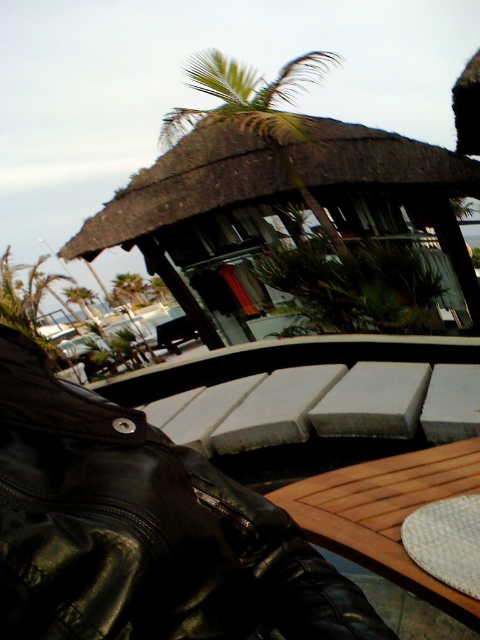
Question: Estimate the real-world distances between objects in this image. Which object is farther from the wooden table at lower center?

Choices:
 (A) green leafy palm tree at upper center
 (B) brown thatched hut at upper center

Answer: (B)

Question: Which of these objects is positioned farthest from the brown thatched hut at upper center?

Choices:
 (A) wooden table at lower center
 (B) green leafy palm tree at upper center

Answer: (B)

Question: From the image, what is the correct spatial relationship of wooden table at lower center in relation to green leafy palm tree at upper center?

Choices:
 (A) right
 (B) left

Answer: (A)

Question: Is brown thatched hut at upper center bigger than wooden table at lower center?

Choices:
 (A) no
 (B) yes

Answer: (B)

Question: Which object is closer to the camera taking this photo?

Choices:
 (A) green leafy palm tree at upper center
 (B) wooden table at lower center

Answer: (B)

Question: Is the position of brown thatched hut at upper center less distant than that of green leafy palm tree at upper center?

Choices:
 (A) no
 (B) yes

Answer: (A)